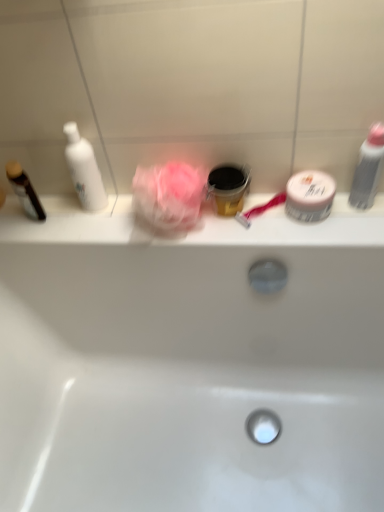
Locate an element on the screen. This screenshot has width=384, height=512. space that is in front of white matte jar at right, which appears as the second toiletry when viewed from the right is located at coordinates (325, 236).